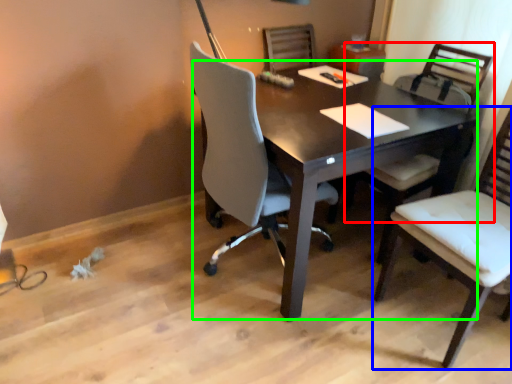
Question: Which is nearer to the chair (highlighted by a red box)? chair (highlighted by a blue box) or desk (highlighted by a green box).

Choices:
 (A) chair
 (B) desk

Answer: (B)